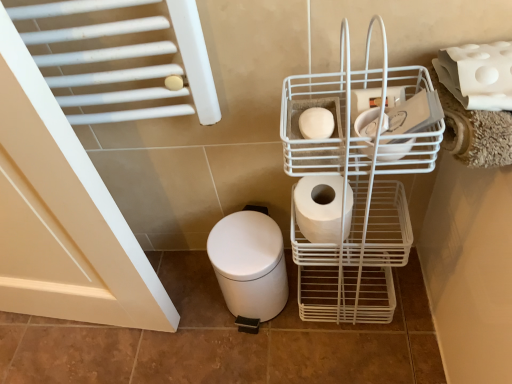
Where is `white matte toilet paper at center right, the third toilet paper from the left`? The height and width of the screenshot is (384, 512). white matte toilet paper at center right, the third toilet paper from the left is located at coordinates (407, 115).

From the picture: Measure the distance between white matte toilet paper at center-right, marked as the third toilet paper in a right-to-left arrangement, and camera.

The depth of white matte toilet paper at center-right, marked as the third toilet paper in a right-to-left arrangement, is 75.58 centimeters.

Where is `white matte toilet paper at upper right, which is counted as the 1th toilet paper, starting from the right`? This screenshot has height=384, width=512. white matte toilet paper at upper right, which is counted as the 1th toilet paper, starting from the right is located at coordinates (478, 75).

This screenshot has height=384, width=512. I want to click on white matte toilet paper at center, the first toilet paper in the left-to-right sequence, so click(316, 123).

Is point (391, 122) in front of point (374, 190)?

That is True.

Is white matte toilet paper at center right, the third toilet paper from the left, next to white wire basket at center right?

white matte toilet paper at center right, the third toilet paper from the left, and white wire basket at center right are clearly separated.

The height and width of the screenshot is (384, 512). In the image, there is a white matte toilet paper at center right, which ranks as the second toilet paper in right-to-left order. Find the location of `shopping cart below it (from the image's perspective)`. shopping cart below it (from the image's perspective) is located at coordinates (358, 184).

Is white matte toilet paper at center right, which ranks as the second toilet paper in right-to-left order, smaller than white wire basket at center right?

Yes, white matte toilet paper at center right, which ranks as the second toilet paper in right-to-left order, is smaller than white wire basket at center right.

Which of these two, white matte toilet paper at upper right, which is counted as the 1th toilet paper, starting from the right, or white matte toilet paper at center-right, marked as the third toilet paper in a right-to-left arrangement, is smaller?

With smaller size is white matte toilet paper at center-right, marked as the third toilet paper in a right-to-left arrangement.

Based on the photo, is white matte toilet paper at upper right, which is counted as the 1th toilet paper, starting from the right, looking in the opposite direction of white matte toilet paper at center-right, the second toilet paper when ordered from left to right?

That's not correct — white matte toilet paper at upper right, which is counted as the 1th toilet paper, starting from the right, is not looking away from white matte toilet paper at center-right, the second toilet paper when ordered from left to right.

Consider the image. Is white matte toilet paper at upper right, which is counted as the 1th toilet paper, starting from the right, taller or shorter than white matte toilet paper at center-right, marked as the third toilet paper in a right-to-left arrangement?

Considering their sizes, white matte toilet paper at upper right, which is counted as the 1th toilet paper, starting from the right, has less height than white matte toilet paper at center-right, marked as the third toilet paper in a right-to-left arrangement.

Considering the positions of objects white matte toilet paper at center, positioned as the fourth toilet paper in right-to-left order, and white matte toilet paper at upper right, the 4th toilet paper in the left-to-right sequence, in the image provided, who is more to the right, white matte toilet paper at center, positioned as the fourth toilet paper in right-to-left order, or white matte toilet paper at upper right, the 4th toilet paper in the left-to-right sequence,?

white matte toilet paper at upper right, the 4th toilet paper in the left-to-right sequence, is more to the right.

Who is taller, white matte toilet paper at center, positioned as the fourth toilet paper in right-to-left order, or white matte toilet paper at upper right, the 4th toilet paper in the left-to-right sequence?

white matte toilet paper at upper right, the 4th toilet paper in the left-to-right sequence.

Is white matte toilet paper at center, positioned as the fourth toilet paper in right-to-left order, further to the viewer compared to white matte toilet paper at upper right, the 4th toilet paper in the left-to-right sequence?

That is True.

Are white matte toilet paper at center, the first toilet paper in the left-to-right sequence, and white matte toilet paper at upper right, the 4th toilet paper in the left-to-right sequence, located far from each other?

Actually, white matte toilet paper at center, the first toilet paper in the left-to-right sequence, and white matte toilet paper at upper right, the 4th toilet paper in the left-to-right sequence, are a little close together.

How many degrees apart are the facing directions of white wire basket at center right and white matte toilet paper at center right, the third toilet paper from the left?

They differ by 0.000195 degrees in their facing directions.

Which is behind, point (347, 291) or point (389, 130)?

The point (347, 291) is behind.

From the picture: Is white wire basket at center right in front of or behind white matte toilet paper at center right, the third toilet paper from the left, in the image?

white wire basket at center right is positioned closer to the viewer than white matte toilet paper at center right, the third toilet paper from the left.

Considering the sizes of objects white wire basket at center right and white matte toilet paper at center right, which ranks as the second toilet paper in right-to-left order, in the image provided, who is taller, white wire basket at center right or white matte toilet paper at center right, which ranks as the second toilet paper in right-to-left order,?

Standing taller between the two is white wire basket at center right.

Would you say white wire basket at center right is a long distance from white matte toilet paper at center-right, marked as the third toilet paper in a right-to-left arrangement?

white wire basket at center right is actually quite close to white matte toilet paper at center-right, marked as the third toilet paper in a right-to-left arrangement.

Considering the sizes of objects white wire basket at center right and white matte toilet paper at center-right, the second toilet paper when ordered from left to right, in the image provided, who is wider, white wire basket at center right or white matte toilet paper at center-right, the second toilet paper when ordered from left to right,?

white wire basket at center right.

Between white wire basket at center right and white matte toilet paper at center-right, marked as the third toilet paper in a right-to-left arrangement, which one appears on the left side from the viewer's perspective?

white matte toilet paper at center-right, marked as the third toilet paper in a right-to-left arrangement, is more to the left.

Considering the relative positions of white matte toilet paper at center-right, the second toilet paper when ordered from left to right, and white matte toilet paper at upper right, which is counted as the 1th toilet paper, starting from the right, in the image provided, is white matte toilet paper at center-right, the second toilet paper when ordered from left to right, in front of white matte toilet paper at upper right, which is counted as the 1th toilet paper, starting from the right,?

No, it is not.

From the image's perspective, is white matte toilet paper at center-right, the second toilet paper when ordered from left to right, below white matte toilet paper at upper right, which is counted as the 1th toilet paper, starting from the right?

Yes, from the image's perspective, white matte toilet paper at center-right, the second toilet paper when ordered from left to right, is below white matte toilet paper at upper right, which is counted as the 1th toilet paper, starting from the right.

Could you tell me if white matte toilet paper at center-right, marked as the third toilet paper in a right-to-left arrangement, is turned towards white matte toilet paper at upper right, the 4th toilet paper in the left-to-right sequence?

No, white matte toilet paper at center-right, marked as the third toilet paper in a right-to-left arrangement, is not facing towards white matte toilet paper at upper right, the 4th toilet paper in the left-to-right sequence.

Is white matte toilet paper at center right, the third toilet paper from the left, turned away from white matte toilet paper at center, the first toilet paper in the left-to-right sequence?

white matte toilet paper at center right, the third toilet paper from the left, does not have its back to white matte toilet paper at center, the first toilet paper in the left-to-right sequence.

From the image's perspective, who appears lower, white matte toilet paper at center right, the third toilet paper from the left, or white matte toilet paper at center, the first toilet paper in the left-to-right sequence?

From the image's view, white matte toilet paper at center right, the third toilet paper from the left, is below.

Considering the relative sizes of white matte toilet paper at center right, the third toilet paper from the left, and white matte toilet paper at center, positioned as the fourth toilet paper in right-to-left order, in the image provided, is white matte toilet paper at center right, the third toilet paper from the left, shorter than white matte toilet paper at center, positioned as the fourth toilet paper in right-to-left order,?

In fact, white matte toilet paper at center right, the third toilet paper from the left, may be taller than white matte toilet paper at center, positioned as the fourth toilet paper in right-to-left order.

I want to click on the 1st toilet paper below when counting from the white matte toilet paper at center, positioned as the fourth toilet paper in right-to-left order (from the image's perspective), so click(407, 115).

I want to click on the 2nd toilet paper behind the white wire basket at center right, so click(x=407, y=115).

Locate an element on the screen. The width and height of the screenshot is (512, 384). the 3rd toilet paper directly above the white matte toilet paper at center-right, marked as the third toilet paper in a right-to-left arrangement (from a real-world perspective) is located at coordinates (478, 75).

Considering their positions, is white matte toilet paper at center, the first toilet paper in the left-to-right sequence, positioned further to white matte toilet bowl at lower left than white wire basket at center right?

Among the two, white matte toilet paper at center, the first toilet paper in the left-to-right sequence, is located further to white matte toilet bowl at lower left.

Considering their positions, is white matte toilet paper at upper right, the 4th toilet paper in the left-to-right sequence, positioned further to white matte toilet bowl at lower left than white matte toilet paper at center, the first toilet paper in the left-to-right sequence?

white matte toilet paper at upper right, the 4th toilet paper in the left-to-right sequence, is positioned further to the anchor white matte toilet bowl at lower left.

Based on their spatial positions, is white matte toilet paper at center right, which ranks as the second toilet paper in right-to-left order, or white wire basket at center right further from white matte toilet bowl at lower left?

white matte toilet paper at center right, which ranks as the second toilet paper in right-to-left order.

Estimate the real-world distances between objects in this image. Which object is further from white matte toilet paper at center right, which ranks as the second toilet paper in right-to-left order, white matte toilet paper at center-right, the second toilet paper when ordered from left to right, or white wire basket at center right?

white wire basket at center right lies further to white matte toilet paper at center right, which ranks as the second toilet paper in right-to-left order, than the other object.

When comparing their distances from white matte toilet paper at upper right, the 4th toilet paper in the left-to-right sequence, does white matte toilet paper at center, positioned as the fourth toilet paper in right-to-left order, or white matte toilet paper at center right, the third toilet paper from the left, seem closer?

white matte toilet paper at center right, the third toilet paper from the left, lies closer to white matte toilet paper at upper right, the 4th toilet paper in the left-to-right sequence, than the other object.

Based on the photo, considering their positions, is white matte toilet bowl at lower left positioned further to white wire basket at center right than white matte toilet paper at center-right, marked as the third toilet paper in a right-to-left arrangement?

white matte toilet bowl at lower left lies further to white wire basket at center right than the other object.

From the image, which object appears to be farther from white matte toilet paper at center right, which ranks as the second toilet paper in right-to-left order, white matte toilet paper at center-right, marked as the third toilet paper in a right-to-left arrangement, or white matte toilet paper at upper right, which is counted as the 1th toilet paper, starting from the right?

white matte toilet paper at center-right, marked as the third toilet paper in a right-to-left arrangement, is positioned further to the anchor white matte toilet paper at center right, which ranks as the second toilet paper in right-to-left order.

Considering their positions, is white matte toilet paper at center-right, the second toilet paper when ordered from left to right, positioned closer to white matte toilet paper at upper right, which is counted as the 1th toilet paper, starting from the right, than white wire basket at center right?

white wire basket at center right is closer to white matte toilet paper at upper right, which is counted as the 1th toilet paper, starting from the right.

At what (x,y) coordinates should I click in order to perform the action: click on toilet paper located between white matte toilet paper at center right, which ranks as the second toilet paper in right-to-left order, and white matte toilet paper at center-right, the second toilet paper when ordered from left to right, in the depth direction. Please return your answer as a coordinate pair (x, y). This screenshot has height=384, width=512. Looking at the image, I should click on (316, 123).

Locate an element on the screen. Image resolution: width=512 pixels, height=384 pixels. toilet paper between white matte toilet paper at center right, the third toilet paper from the left, and white matte toilet bowl at lower left vertically is located at coordinates (319, 208).

The image size is (512, 384). What are the coordinates of `shopping cart between white matte toilet paper at center, the first toilet paper in the left-to-right sequence, and white matte toilet paper at upper right, which is counted as the 1th toilet paper, starting from the right` in the screenshot? It's located at (358, 184).

Identify the location of shopping cart between white matte toilet paper at center-right, marked as the third toilet paper in a right-to-left arrangement, and white matte toilet paper at upper right, which is counted as the 1th toilet paper, starting from the right. This screenshot has height=384, width=512. (358, 184).